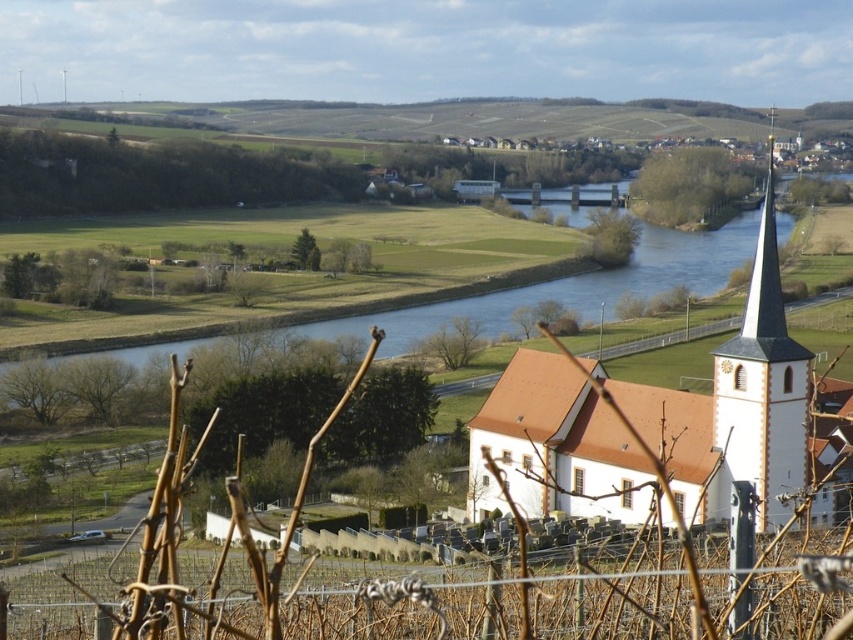
Question: Which object is positioned farthest from the white stucco tower at right?

Choices:
 (A) blue water at center
 (B) white matte church at center

Answer: (A)

Question: Can you confirm if white matte church at center is positioned to the left of blue water at center?

Choices:
 (A) yes
 (B) no

Answer: (B)

Question: Is white matte church at center bigger than white stucco tower at right?

Choices:
 (A) yes
 (B) no

Answer: (B)

Question: Does white stucco tower at right appear on the left side of blue water at center?

Choices:
 (A) no
 (B) yes

Answer: (A)

Question: Which object is farther from the camera taking this photo?

Choices:
 (A) white matte church at center
 (B) white stucco tower at right
 (C) blue water at center

Answer: (C)

Question: Which object is the farthest from the blue water at center?

Choices:
 (A) white matte church at center
 (B) white stucco tower at right

Answer: (A)